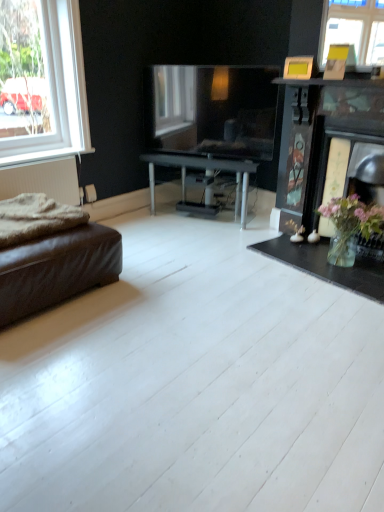
Question: Can you confirm if brown leather studio couch at lower left is shorter than white plastic window at upper left?

Choices:
 (A) no
 (B) yes

Answer: (B)

Question: From the image's perspective, is brown leather studio couch at lower left under white plastic window at upper left?

Choices:
 (A) yes
 (B) no

Answer: (A)

Question: Considering the relative sizes of brown leather studio couch at lower left and white plastic window at upper left in the image provided, is brown leather studio couch at lower left wider than white plastic window at upper left?

Choices:
 (A) no
 (B) yes

Answer: (B)

Question: From a real-world perspective, is brown leather studio couch at lower left located higher than white plastic window at upper left?

Choices:
 (A) no
 (B) yes

Answer: (A)

Question: Considering the relative sizes of brown leather studio couch at lower left and white plastic window at upper left in the image provided, is brown leather studio couch at lower left bigger than white plastic window at upper left?

Choices:
 (A) yes
 (B) no

Answer: (A)

Question: From the image's perspective, relative to brown leather studio couch at lower left, is white plastic window at upper left above or below?

Choices:
 (A) above
 (B) below

Answer: (A)

Question: Is white plastic window at upper left bigger or smaller than brown leather studio couch at lower left?

Choices:
 (A) big
 (B) small

Answer: (B)

Question: Is white plastic window at upper left situated inside brown leather studio couch at lower left or outside?

Choices:
 (A) inside
 (B) outside

Answer: (B)

Question: In the image, is white plastic window at upper left on the left side or the right side of brown leather studio couch at lower left?

Choices:
 (A) right
 (B) left

Answer: (B)

Question: Considering their positions, is white plastic window at upper left located in front of or behind clear glass vase at lower right?

Choices:
 (A) front
 (B) behind

Answer: (B)

Question: Is white plastic window at upper left bigger or smaller than clear glass vase at lower right?

Choices:
 (A) small
 (B) big

Answer: (B)

Question: Is point (66, 148) positioned closer to the camera than point (372, 269)?

Choices:
 (A) farther
 (B) closer

Answer: (A)

Question: In the image, is white plastic window at upper left on the left side or the right side of clear glass vase at lower right?

Choices:
 (A) left
 (B) right

Answer: (A)

Question: Choose the correct answer: Is brown leather studio couch at lower left inside clear glass vase at lower right or outside it?

Choices:
 (A) outside
 (B) inside

Answer: (A)

Question: From the image's perspective, is brown leather studio couch at lower left above or below clear glass vase at lower right?

Choices:
 (A) below
 (B) above

Answer: (B)